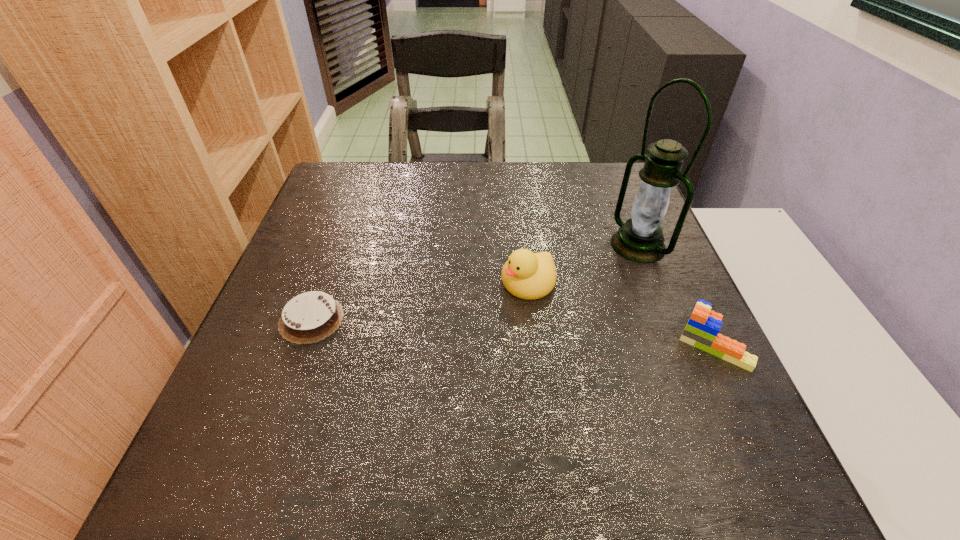
The height and width of the screenshot is (540, 960). I want to click on chocolate cake, so click(309, 317).

Locate an element on the screen. the leftmost object is located at coordinates (309, 317).

Image resolution: width=960 pixels, height=540 pixels. Identify the location of Lego. click(x=703, y=326).

Locate an element on the screen. lantern is located at coordinates (640, 239).

Locate an element on the screen. the second object from left to right is located at coordinates (527, 275).

Identify the location of duckling. The image size is (960, 540). (x=527, y=275).

Find the location of a particular element. This screenshot has height=540, width=960. free location located 0.200m on the back of the chocolate cake is located at coordinates (341, 238).

Where is `free space located 0.060m on the front of the Lego`? free space located 0.060m on the front of the Lego is located at coordinates (740, 401).

I want to click on free spot located 0.220m on the side where the lantern emits light, so click(x=549, y=295).

You are a GUI agent. You are given a task and a screenshot of the screen. Output one action in this format:
    pyautogui.click(x=<x>, y=<y>)
    Task: Click on the vacant region located 0.400m on the side where the lantern emits light
    Image resolution: width=960 pixels, height=540 pixels.
    Given the screenshot: What is the action you would take?
    pyautogui.click(x=480, y=332)